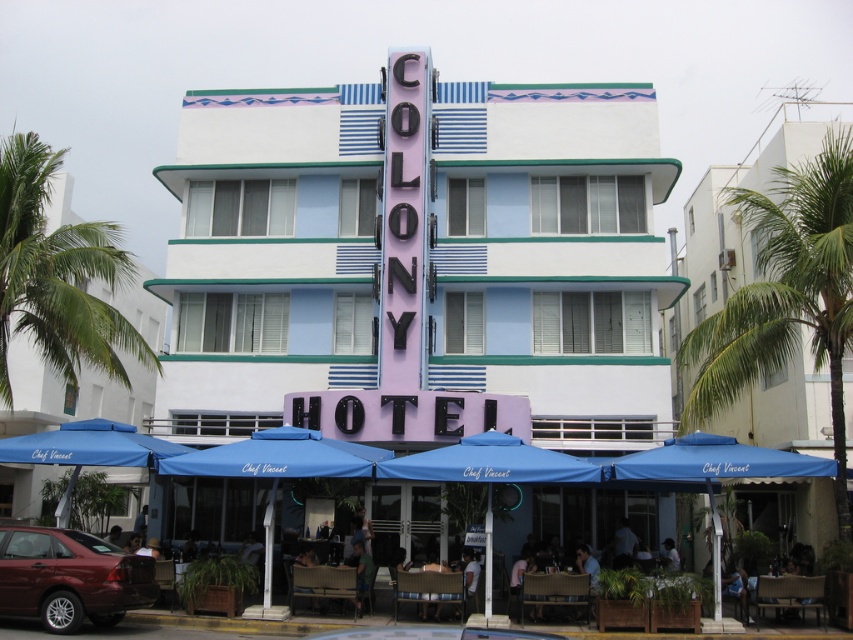
Question: Which point is farther from the camera taking this photo?

Choices:
 (A) (53, 632)
 (B) (91, 460)

Answer: (B)

Question: Does pastel purple sign at center have a greater width compared to shiny maroon sedan at lower left?

Choices:
 (A) no
 (B) yes

Answer: (B)

Question: Which object is closer to the camera taking this photo?

Choices:
 (A) green leafy palm tree at left
 (B) shiny maroon sedan at lower left
 (C) blue fabric umbrella at lower left
 (D) blue fabric umbrella at lower center

Answer: (B)

Question: Which point appears farthest from the camera in this image?

Choices:
 (A) (517, 461)
 (B) (137, 580)

Answer: (A)

Question: Does green leafy palm tree at right have a larger size compared to shiny maroon sedan at lower left?

Choices:
 (A) yes
 (B) no

Answer: (A)

Question: Is pastel purple sign at center wider than blue fabric umbrella at lower center?

Choices:
 (A) yes
 (B) no

Answer: (A)